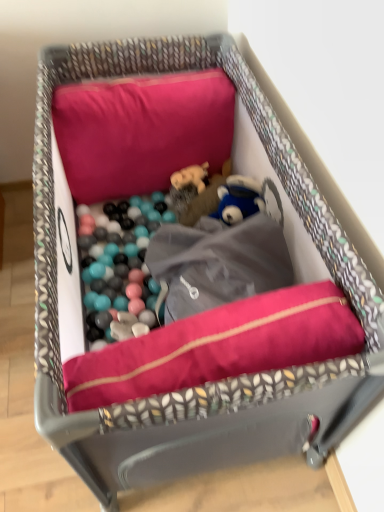
Question: Does matte pink pillow at upper center have a greater height compared to velvet-like pink cushion at center?

Choices:
 (A) yes
 (B) no

Answer: (A)

Question: Can you confirm if matte pink pillow at upper center is bigger than velvet-like pink cushion at center?

Choices:
 (A) yes
 (B) no

Answer: (A)

Question: Could you tell me if matte pink pillow at upper center is facing velvet-like pink cushion at center?

Choices:
 (A) no
 (B) yes

Answer: (A)

Question: From a real-world perspective, does matte pink pillow at upper center sit lower than velvet-like pink cushion at center?

Choices:
 (A) yes
 (B) no

Answer: (B)

Question: Is matte pink pillow at upper center in contact with velvet-like pink cushion at center?

Choices:
 (A) yes
 (B) no

Answer: (B)

Question: Is matte pink pillow at upper center surrounding velvet-like pink cushion at center?

Choices:
 (A) yes
 (B) no

Answer: (B)

Question: Can we say velvet-like pink cushion at center lies outside matte pink pillow at upper center?

Choices:
 (A) no
 (B) yes

Answer: (B)

Question: Considering the relative sizes of velvet-like pink cushion at center and matte pink pillow at upper center in the image provided, is velvet-like pink cushion at center taller than matte pink pillow at upper center?

Choices:
 (A) no
 (B) yes

Answer: (A)

Question: Is velvet-like pink cushion at center closer to the viewer compared to matte pink pillow at upper center?

Choices:
 (A) yes
 (B) no

Answer: (A)

Question: Is velvet-like pink cushion at center facing towards matte pink pillow at upper center?

Choices:
 (A) yes
 (B) no

Answer: (A)

Question: Can you confirm if velvet-like pink cushion at center is shorter than matte pink pillow at upper center?

Choices:
 (A) yes
 (B) no

Answer: (A)

Question: Can you confirm if velvet-like pink cushion at center is thinner than matte pink pillow at upper center?

Choices:
 (A) no
 (B) yes

Answer: (B)

Question: Do you think velvet-like pink cushion at center is within matte pink pillow at upper center, or outside of it?

Choices:
 (A) outside
 (B) inside

Answer: (A)